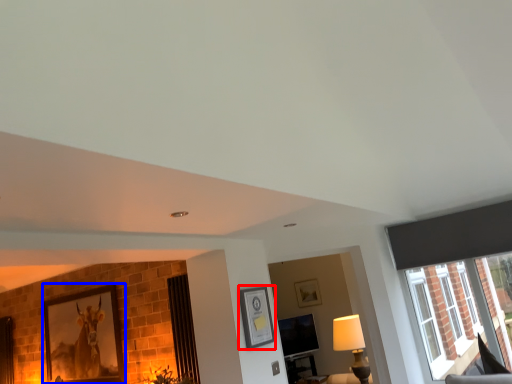
Question: Which of the following is the farthest to the observer, picture frame (highlighted by a red box) or picture frame (highlighted by a blue box)?

Choices:
 (A) picture frame
 (B) picture frame

Answer: (B)